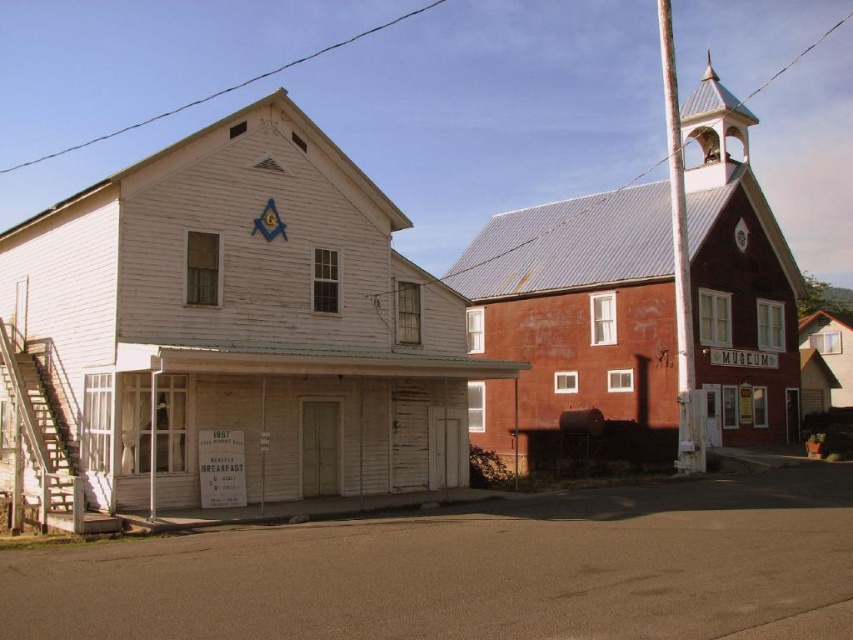
Is white wooden chapel at left wider than rustic wood chapel at right?

Incorrect, white wooden chapel at left's width does not surpass rustic wood chapel at right's.

Who is higher up, white wooden chapel at left or rustic wood chapel at right?

Positioned higher is rustic wood chapel at right.

Locate an element on the screen. The image size is (853, 640). white wooden chapel at left is located at coordinates (231, 330).